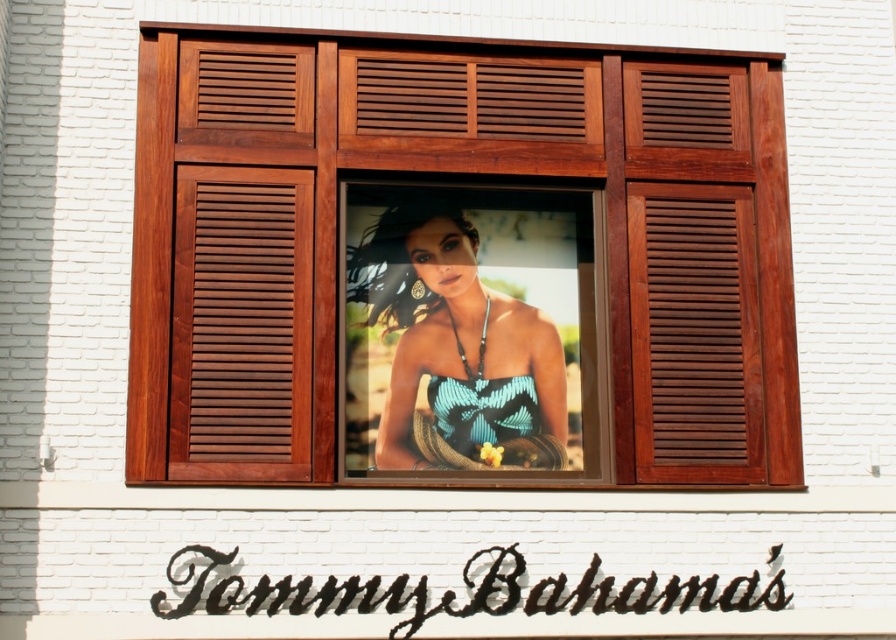
Question: Which of the following is the farthest from the observer?

Choices:
 (A) mahogany wood shutter at right
 (B) blue woven fabric dress at center
 (C) matte blue fabric at center
 (D) brown wooden shutter at left

Answer: (B)

Question: Is matte blue fabric at center below blue woven fabric dress at center?

Choices:
 (A) no
 (B) yes

Answer: (A)

Question: Can you confirm if brown wooden shutter at left is bigger than mahogany wood shutter at right?

Choices:
 (A) no
 (B) yes

Answer: (A)

Question: Which object appears closest to the camera in this image?

Choices:
 (A) matte blue fabric at center
 (B) mahogany wood shutter at right
 (C) brown wooden shutter at left
 (D) blue woven fabric dress at center

Answer: (C)

Question: Which of the following is the farthest from the observer?

Choices:
 (A) blue woven fabric dress at center
 (B) matte blue fabric at center

Answer: (A)

Question: Can you confirm if brown wooden shutter at left is positioned below blue woven fabric dress at center?

Choices:
 (A) no
 (B) yes

Answer: (A)